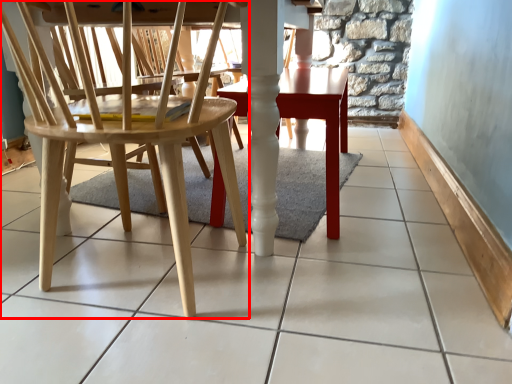
Question: From the image's perspective, what is the correct spatial relationship of chair (annotated by the red box) in relation to table?

Choices:
 (A) above
 (B) below

Answer: (B)